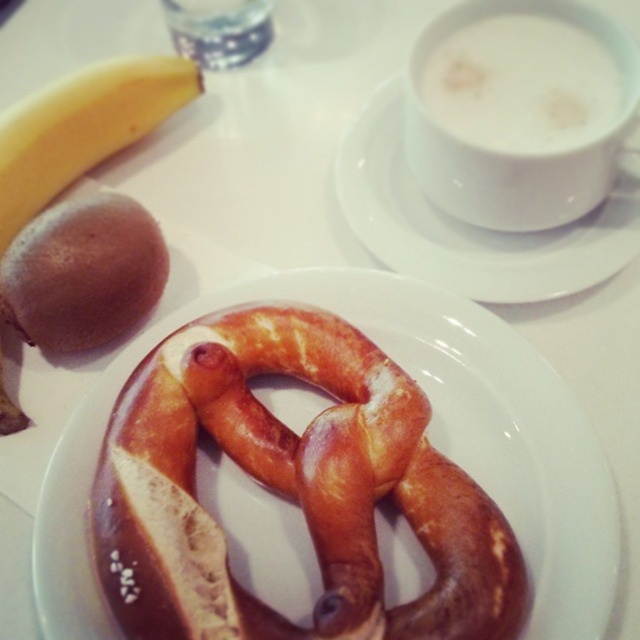
You are a chef arranging fruits on a table. You have a yellow matte banana at upper left and a translucent plastic bottle at upper center. Which object is taller?

The yellow matte banana at upper left is taller than the translucent plastic bottle at upper center according to the description.

You are a chef arranging fruits on a table. You have a yellow matte banana at upper left and a translucent plastic bottle at upper center. According to the scene, where should you place the banana relative to the bottle?

The yellow matte banana at upper left should be placed below the translucent plastic bottle at upper center.